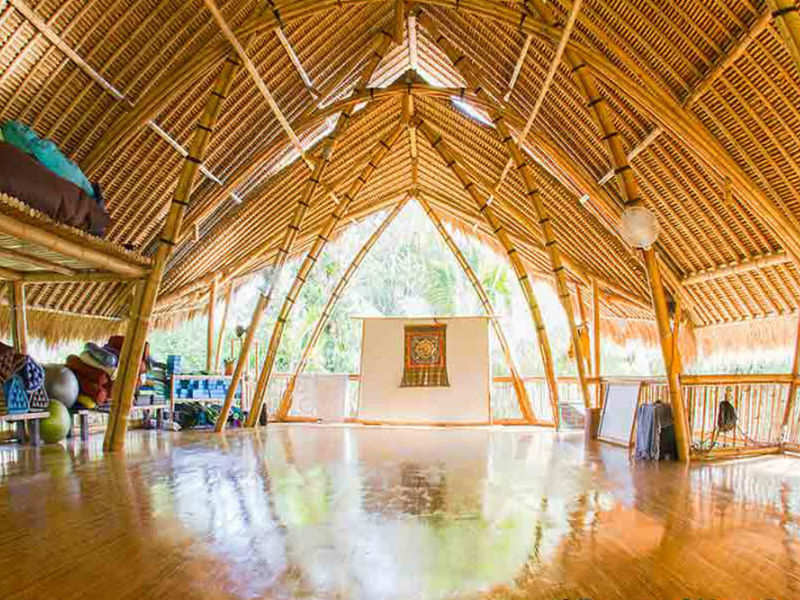
Locate an element on the screen. The height and width of the screenshot is (600, 800). blanket is located at coordinates (654, 414).